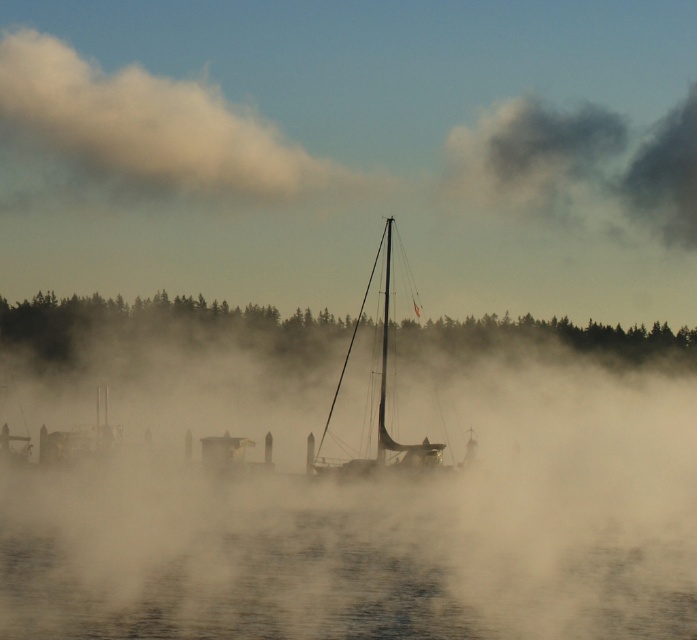
Who is taller, dark gray fluffy cloud at upper right or shiny metallic sailboat at center?

With more height is dark gray fluffy cloud at upper right.

Looking at this image, who is more distant from viewer, [510,168] or [405,464]?

Positioned behind is point [510,168].

Between point (650, 228) and point (388, 296), which one is positioned behind?

Point (650, 228)

Locate an element on the screen. The width and height of the screenshot is (697, 640). dark gray fluffy cloud at upper right is located at coordinates (581, 166).

Between point (199, 420) and point (194, 131), which one is positioned in front?

Point (199, 420) is more forward.

Is translucent misty water at center to the right of foggy white cloud at upper left from the viewer's perspective?

Correct, you'll find translucent misty water at center to the right of foggy white cloud at upper left.

Find the location of a particular element. translucent misty water at center is located at coordinates (360, 509).

What are the coordinates of `translucent misty water at center` in the screenshot? It's located at (360, 509).

Can you confirm if translucent misty water at center is positioned to the right of shiny metallic sailboat at center?

Incorrect, translucent misty water at center is not on the right side of shiny metallic sailboat at center.

Who is more distant from viewer, (70, 518) or (381, 422)?

The point (381, 422) is more distant.

I want to click on translucent misty water at center, so click(x=360, y=509).